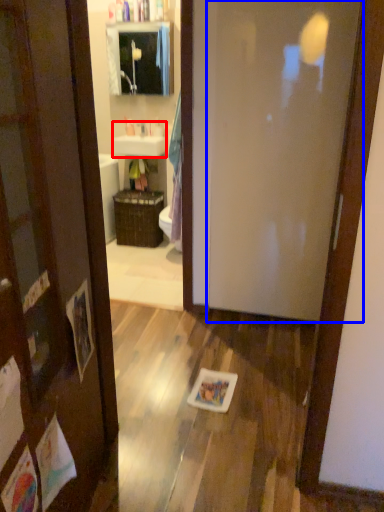
Question: Which object is closer to the camera taking this photo, sink (highlighted by a red box) or door (highlighted by a blue box)?

Choices:
 (A) sink
 (B) door

Answer: (B)